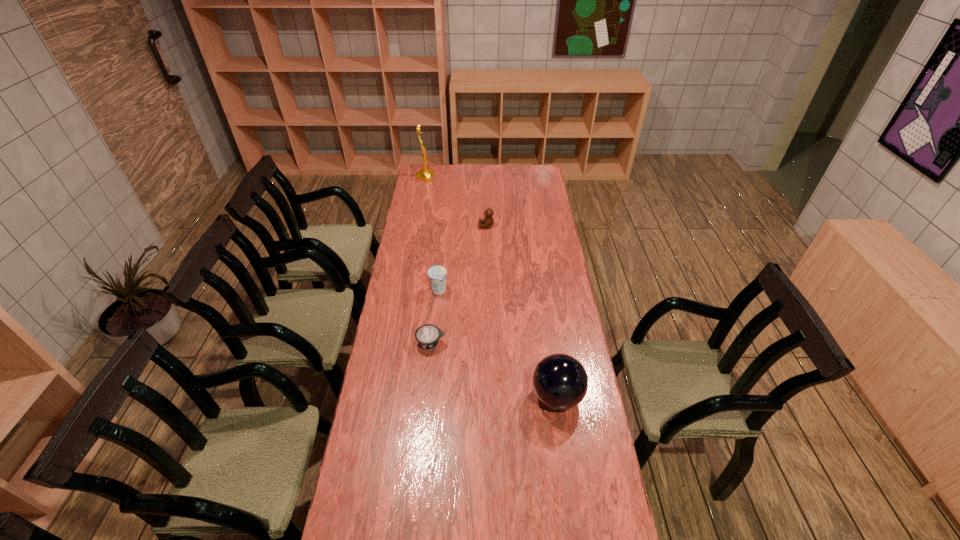
Locate an element on the screen. unoccupied position between the teddy bear and the bowling ball is located at coordinates (521, 311).

Identify the location of free space between the second tallest object and the award. (491, 287).

Find the location of a particular element. The height and width of the screenshot is (540, 960). vacant space in between the taller yogurt and the shorter yogurt is located at coordinates point(435,317).

Where is `free area in between the tallest object and the fourth object from left to right`? Image resolution: width=960 pixels, height=540 pixels. free area in between the tallest object and the fourth object from left to right is located at coordinates click(x=456, y=201).

Find the location of a particular element. empty space between the teddy bear and the fourth farthest object is located at coordinates (459, 285).

Locate an element on the screen. The width and height of the screenshot is (960, 540). free spot between the fourth nearest object and the award is located at coordinates (456, 201).

At what (x,y) coordinates should I click in order to perform the action: click on vacant area between the nearer yogurt and the bowling ball. Please return your answer as a coordinate pair (x, y). Image resolution: width=960 pixels, height=540 pixels. Looking at the image, I should click on pyautogui.click(x=494, y=370).

Identify the location of free space between the teddy bear and the nearer yogurt. (459, 285).

Identify which object is located as the fourth nearest to the farthest object. Please provide its 2D coordinates. Your answer should be formatted as a tuple, i.e. [(x, y)], where the tuple contains the x and y coordinates of a point satisfying the conditions above.

[(560, 381)]

Select which object is the closest to the shorter yogurt. Please provide its 2D coordinates. Your answer should be formatted as a tuple, i.e. [(x, y)], where the tuple contains the x and y coordinates of a point satisfying the conditions above.

[(437, 274)]